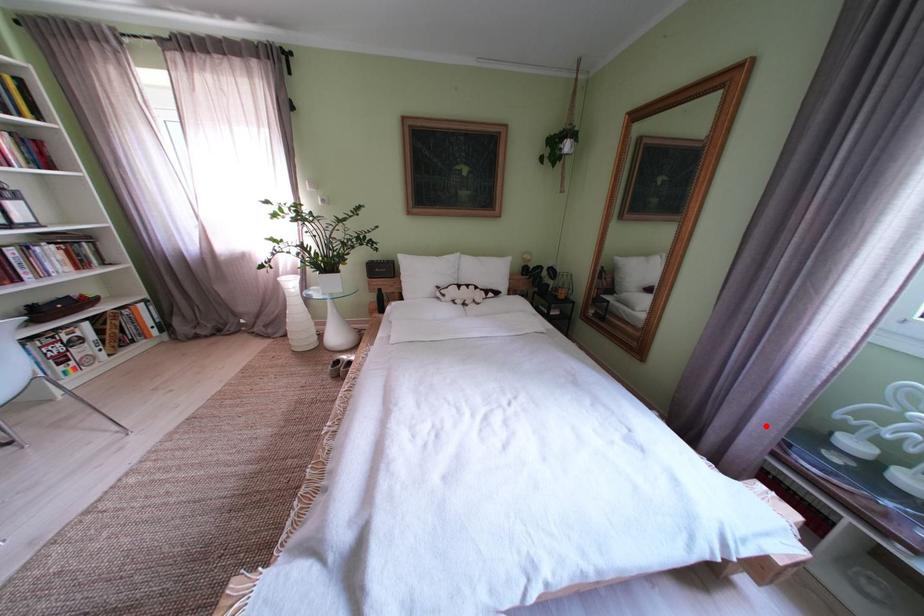
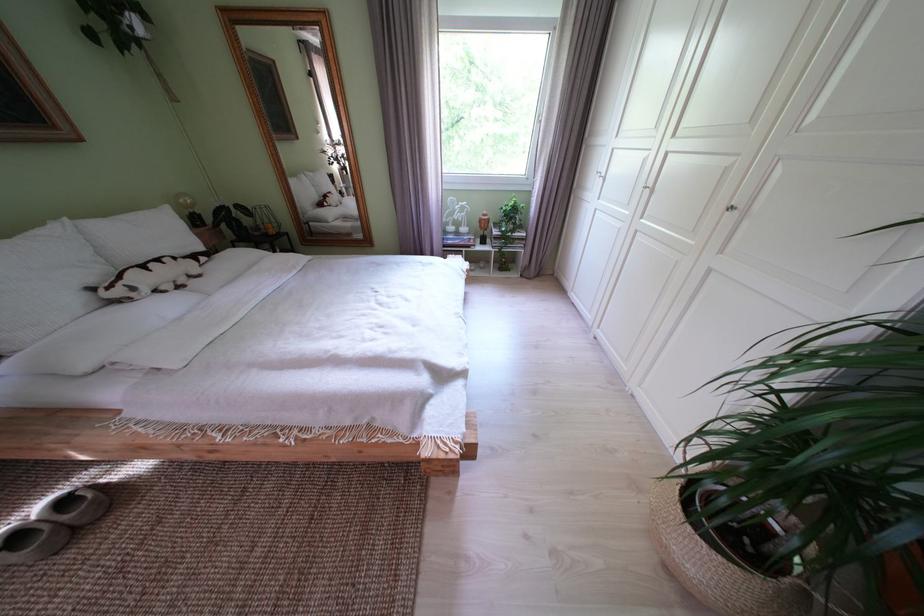
Where in the second image is the point corresponding to the highlighted location from the first image?

(445, 241)